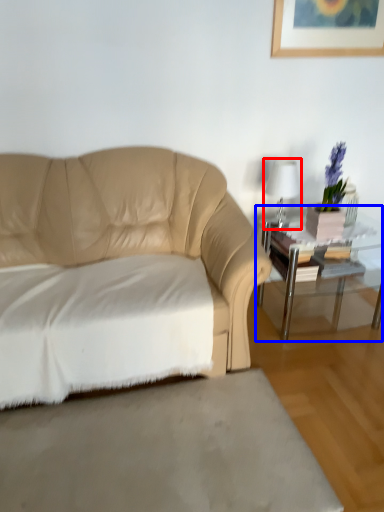
Question: Which object is further to the camera taking this photo, table lamp (highlighted by a red box) or table (highlighted by a blue box)?

Choices:
 (A) table lamp
 (B) table

Answer: (A)